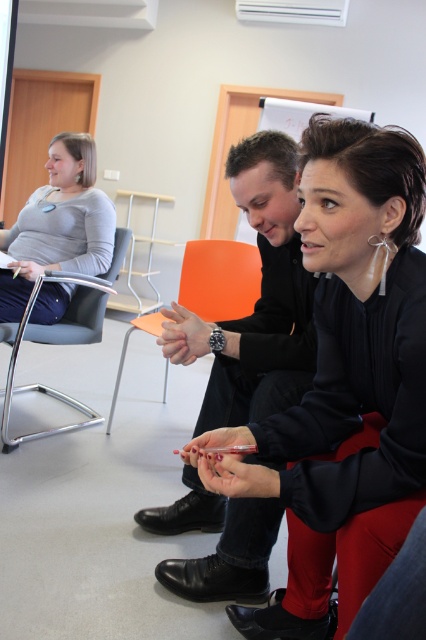
Question: Can you confirm if matte gray sweater at left is smaller than orange plastic chair at center?

Choices:
 (A) yes
 (B) no

Answer: (A)

Question: Is matte gray sweater at left smaller than metallic gray chair at left?

Choices:
 (A) no
 (B) yes

Answer: (B)

Question: Which point is closer to the camera taking this photo?

Choices:
 (A) click(x=83, y=173)
 (B) click(x=210, y=276)
 (C) click(x=97, y=305)

Answer: (A)

Question: Which object is farther from the camera taking this photo?

Choices:
 (A) orange plastic chair at center
 (B) matte gray sweater at left
 (C) metallic gray chair at left

Answer: (A)

Question: Which object appears farthest from the camera in this image?

Choices:
 (A) orange plastic chair at center
 (B) matte gray sweater at left
 (C) metallic gray chair at left

Answer: (A)

Question: Is orange plastic chair at center behind metallic gray chair at left?

Choices:
 (A) no
 (B) yes

Answer: (B)